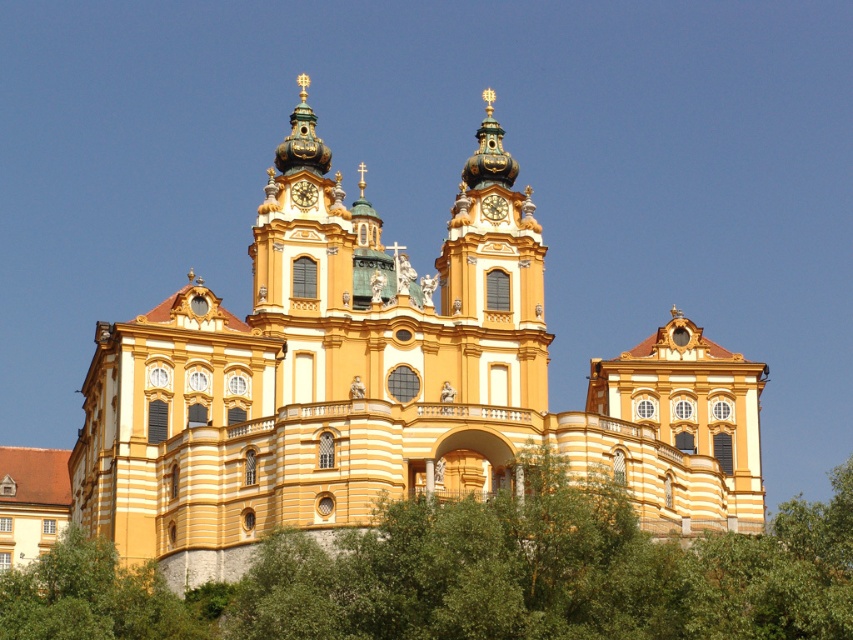
You are a visitor standing in front of the grand building and see the green leafy tree at lower center and the gold metallic clock at center. Which object is wider?

The green leafy tree at lower center is wider than the gold metallic clock at center.

Based on the photo, you are standing in front of the grand building and notice a green leafy tree at lower center and a gold metallic clock at center. Which object is positioned to the right side from your perspective?

The green leafy tree at lower center is positioned to the right of the gold metallic clock at center.

You are standing in front of the grand building and want to take a photo that includes both the green leafy tree at lower left and the gold metallic clock at upper center. Which object should you focus on first to ensure both are in frame?

Since the green leafy tree at lower left is much taller than the gold metallic clock at upper center, you should focus on framing the tree first to accommodate its height, then adjust to include the clock.